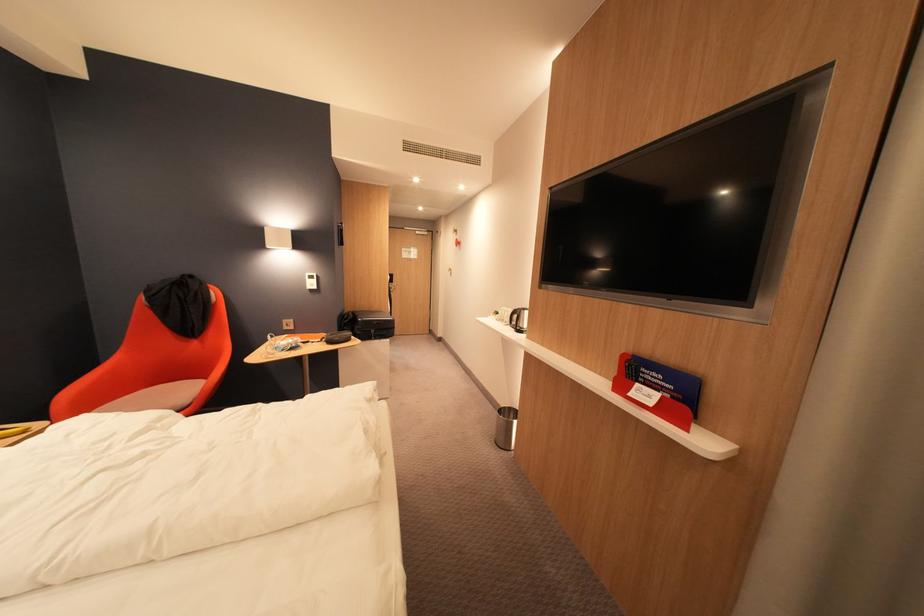
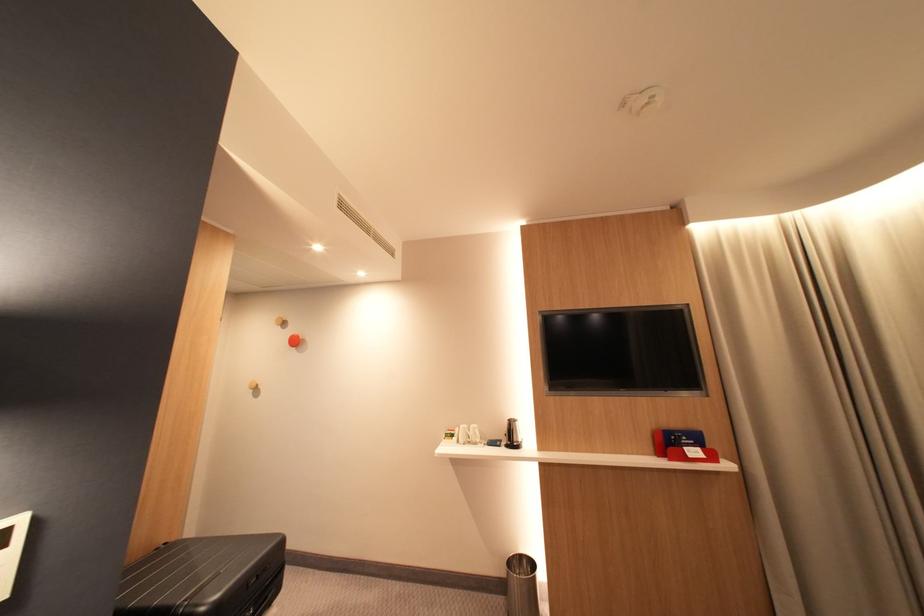
Find the pixel in the second image that matches point 648,386 in the first image.

(696, 450)